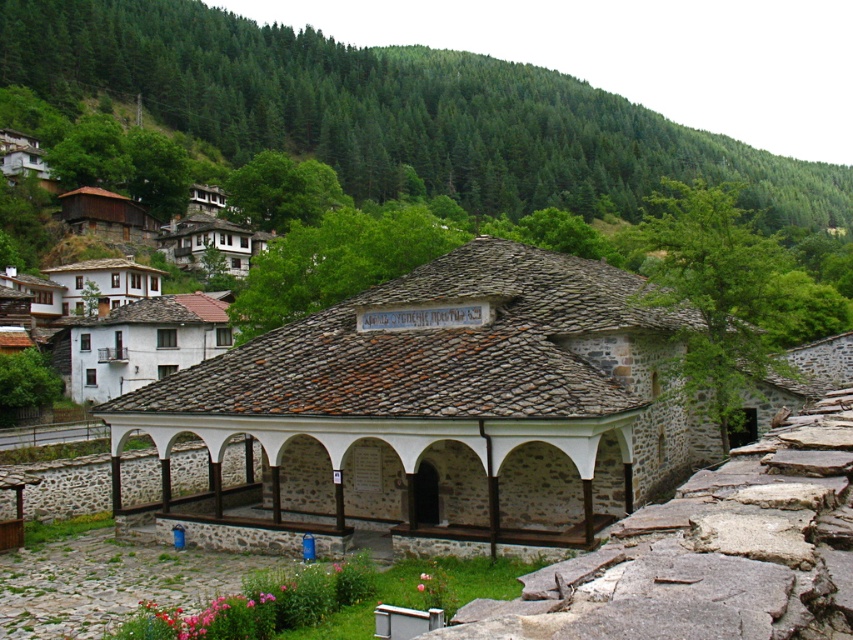
Question: Is stone/rough pergola at center smaller than white stone building at center?

Choices:
 (A) yes
 (B) no

Answer: (A)

Question: Is stone/rough pergola at center above white stone building at center?

Choices:
 (A) no
 (B) yes

Answer: (A)

Question: Is stone/rough pergola at center wider than white stone building at center?

Choices:
 (A) no
 (B) yes

Answer: (A)